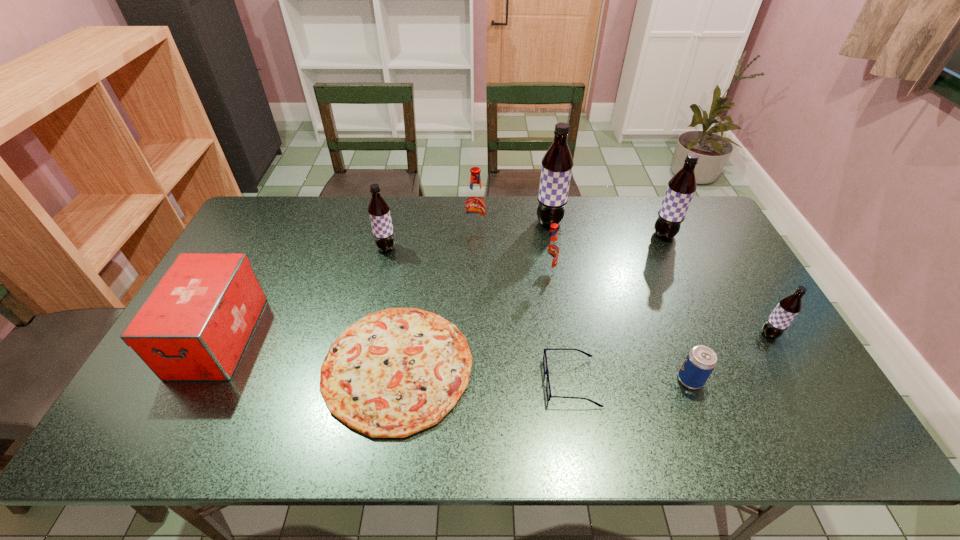
What are the coordinates of `object located at the left edge` in the screenshot? It's located at (194, 325).

Image resolution: width=960 pixels, height=540 pixels. What are the coordinates of `object located in the far right corner section of the desktop` in the screenshot? It's located at (681, 187).

Where is `free location at the far edge of the desktop`? The image size is (960, 540). free location at the far edge of the desktop is located at coordinates (304, 208).

Find the location of a particular element. The height and width of the screenshot is (540, 960). blank space at the near edge of the desktop is located at coordinates (307, 441).

In the image, there is a desktop. Find the location of `vacant space at the left edge`. vacant space at the left edge is located at coordinates (259, 268).

Where is `vacant space at the right edge of the desktop`? The height and width of the screenshot is (540, 960). vacant space at the right edge of the desktop is located at coordinates (756, 360).

Where is `empty location between the nearest root beer and the third shortest object`? empty location between the nearest root beer and the third shortest object is located at coordinates (730, 357).

The image size is (960, 540). Find the location of `vacant space that is in between the right red root beer and the leftmost brown root beer`. vacant space that is in between the right red root beer and the leftmost brown root beer is located at coordinates (468, 260).

You are a GUI agent. You are given a task and a screenshot of the screen. Output one action in this format:
    pyautogui.click(x=<x>, y=<y>)
    Task: Click on the unoccupied position between the smallest brown root beer and the beer can
    This screenshot has height=540, width=960.
    Given the screenshot: What is the action you would take?
    pyautogui.click(x=730, y=357)

This screenshot has width=960, height=540. Find the location of `vacant space in between the rightmost object and the right red root beer`. vacant space in between the rightmost object and the right red root beer is located at coordinates (659, 302).